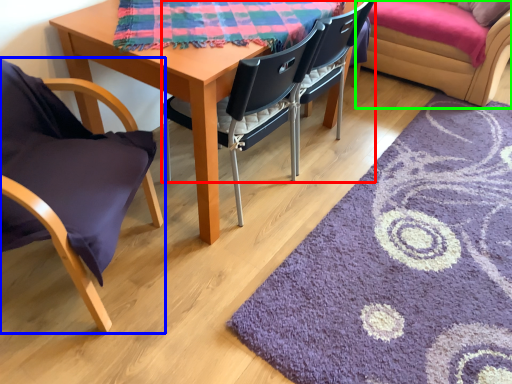
Question: Estimate the real-world distances between objects in this image. Which object is farther from chair (highlighted by a red box), chair (highlighted by a blue box) or couch (highlighted by a green box)?

Choices:
 (A) chair
 (B) couch

Answer: (B)